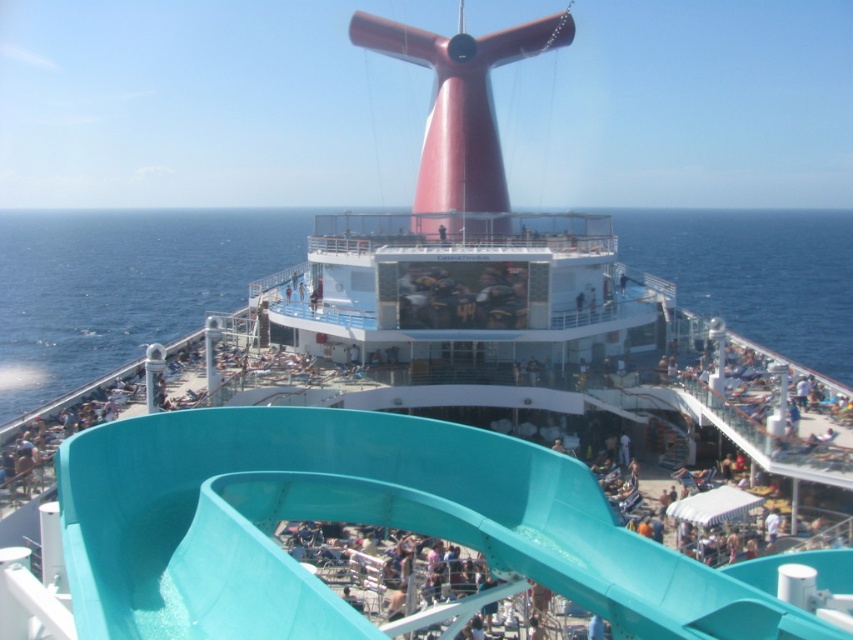
Question: Which point appears closest to the camera in this image?

Choices:
 (A) (425, 483)
 (B) (117, 300)

Answer: (A)

Question: Does teal plastic slide at center have a lesser width compared to teal plastic water slide at upper center?

Choices:
 (A) yes
 (B) no

Answer: (A)

Question: Which point is closer to the camera?

Choices:
 (A) (660, 252)
 (B) (231, 504)

Answer: (B)

Question: Among these points, which one is nearest to the camera?

Choices:
 (A) (74, 378)
 (B) (636, 634)

Answer: (B)

Question: Is teal plastic slide at center closer to camera compared to teal plastic water slide at upper center?

Choices:
 (A) yes
 (B) no

Answer: (A)

Question: In this image, where is teal plastic slide at center located relative to teal plastic water slide at upper center?

Choices:
 (A) below
 (B) above

Answer: (A)